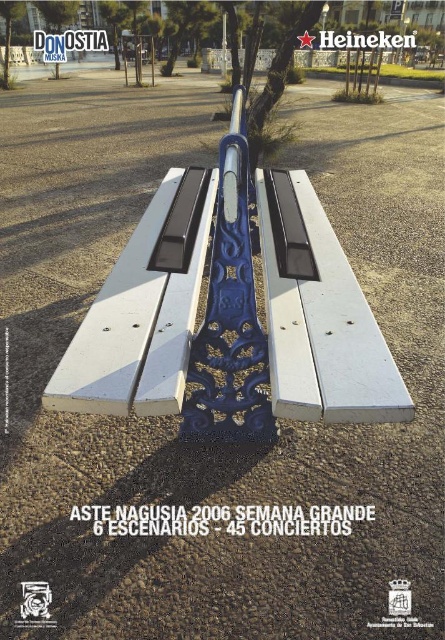
Does white painted wood bench at center have a larger size compared to blue metallic pole at center?

Indeed, white painted wood bench at center has a larger size compared to blue metallic pole at center.

Who is taller, white painted wood bench at center or blue metallic pole at center?

With more height is white painted wood bench at center.

Who is more distant from viewer, (255,385) or (223,35)?

Positioned behind is point (223,35).

Identify the location of white painted wood bench at center. This screenshot has height=640, width=445. tap(231, 312).